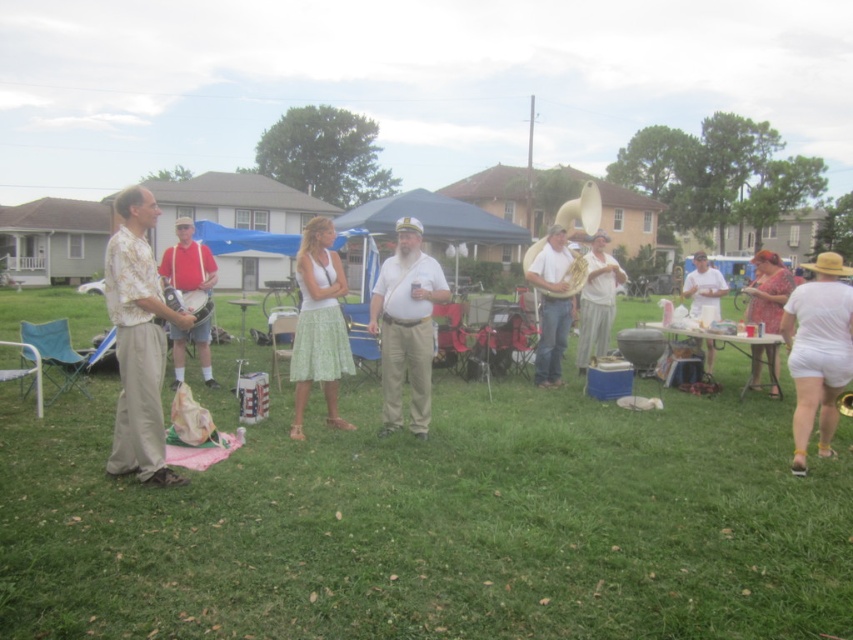
Question: Is green textured skirt at center further to camera compared to gold brass tuba at center?

Choices:
 (A) yes
 (B) no

Answer: (B)

Question: From the image, what is the correct spatial relationship of floral dress at right in relation to matte black banjo at center?

Choices:
 (A) below
 (B) above

Answer: (A)

Question: Considering the real-world distances, which object is farthest from the matte red banjo at left?

Choices:
 (A) white cotton shorts at right
 (B) matte white saxophone at center

Answer: (A)

Question: Which object appears closest to the camera in this image?

Choices:
 (A) floral print shirt at left
 (B) green grass at center
 (C) matte red banjo at left

Answer: (B)

Question: Is the position of white cotton shirt at center more distant than that of gold brass tuba at center?

Choices:
 (A) no
 (B) yes

Answer: (B)

Question: Which point is farther to the camera?

Choices:
 (A) (302, 337)
 (B) (779, 296)
 (C) (700, 262)

Answer: (C)